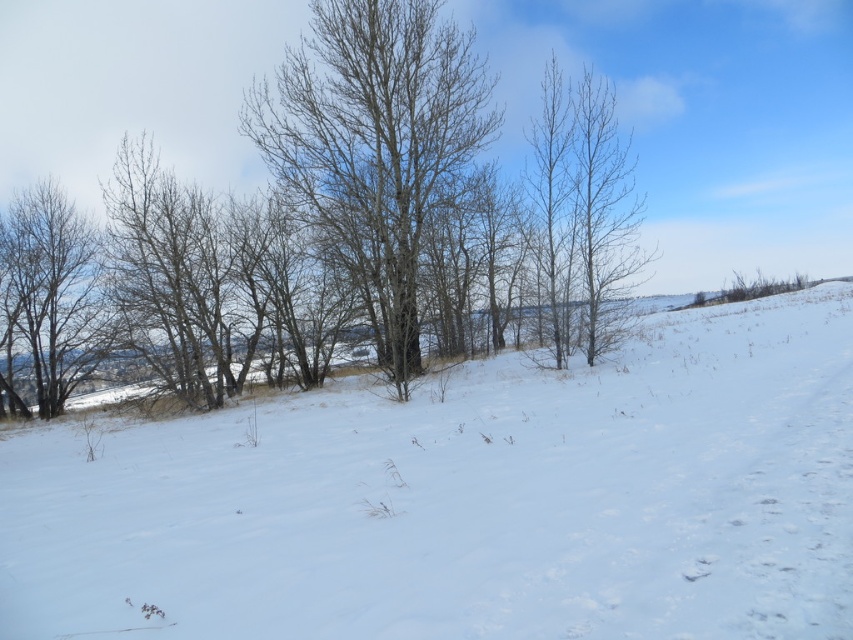
Question: Which point appears farthest from the camera in this image?

Choices:
 (A) (283, 184)
 (B) (85, 298)
 (C) (326, 612)

Answer: (B)

Question: Is snowy white ski slope at center further to camera compared to bare wood tree at center?

Choices:
 (A) yes
 (B) no

Answer: (B)

Question: Which point is farther to the camera?

Choices:
 (A) (444, 420)
 (B) (82, 321)

Answer: (B)

Question: Which object is farther from the camera taking this photo?

Choices:
 (A) brown bark tree at left
 (B) snowy white ski slope at center
 (C) bare branches at center
 (D) bare wood tree at center

Answer: (A)

Question: Does snowy white ski slope at center have a larger size compared to bare wood tree at center?

Choices:
 (A) yes
 (B) no

Answer: (A)

Question: In this image, where is snowy white ski slope at center located relative to bare wood tree at center?

Choices:
 (A) left
 (B) right

Answer: (B)